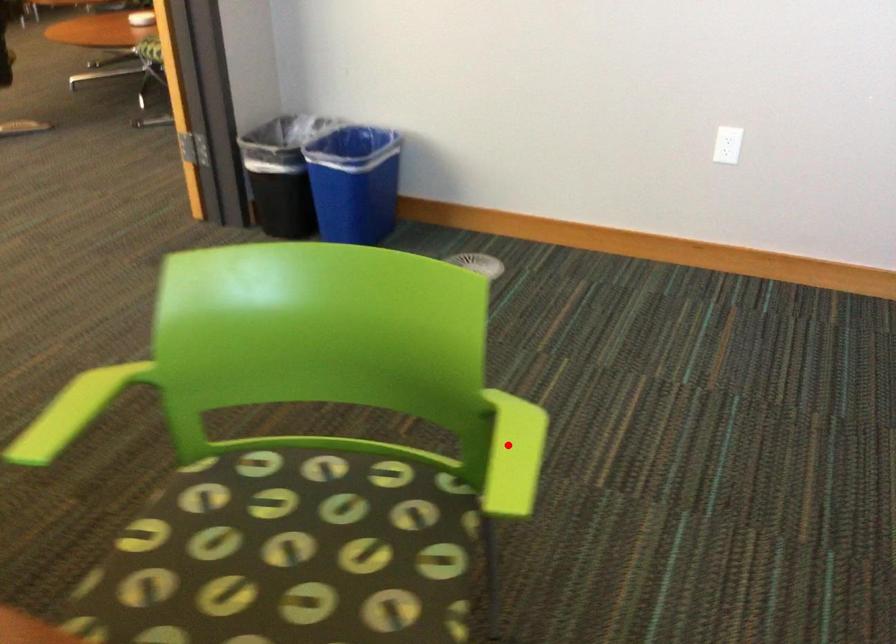
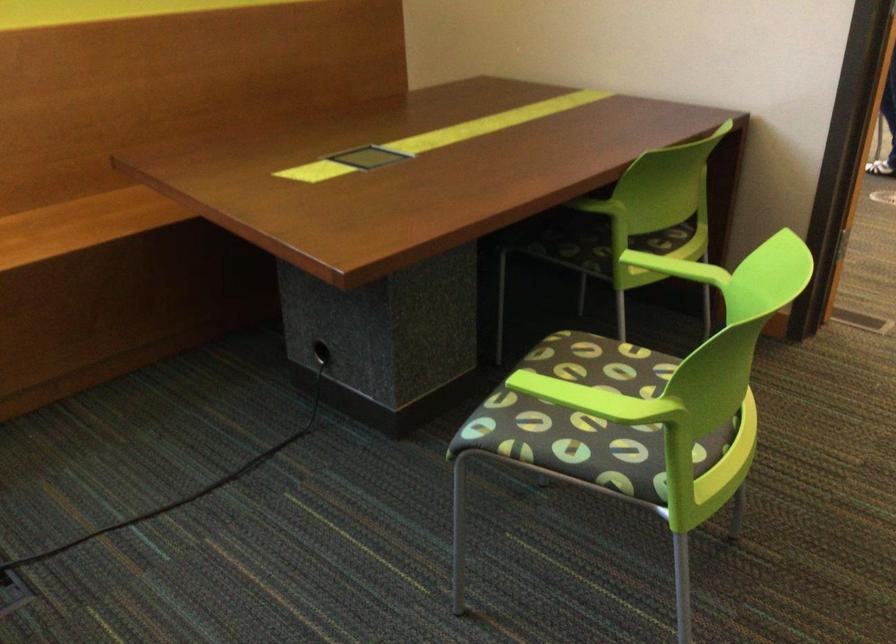
In the second image, find the point that corresponds to the highlighted location in the first image.

(599, 399)